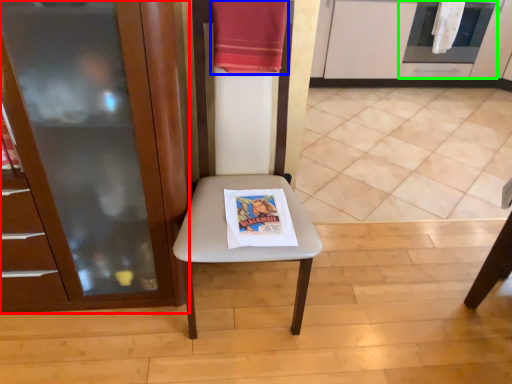
Question: Based on their relative distances, which object is nearer to cabinetry (highlighted by a red box)? Choose from beach towel (highlighted by a blue box) and oven (highlighted by a green box).

Choices:
 (A) beach towel
 (B) oven

Answer: (A)